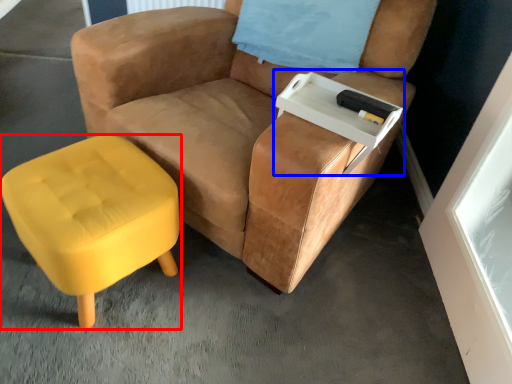
Question: Which point is closer to the camera, stool (highlighted by a red box) or side table (highlighted by a blue box)?

Choices:
 (A) stool
 (B) side table

Answer: (A)